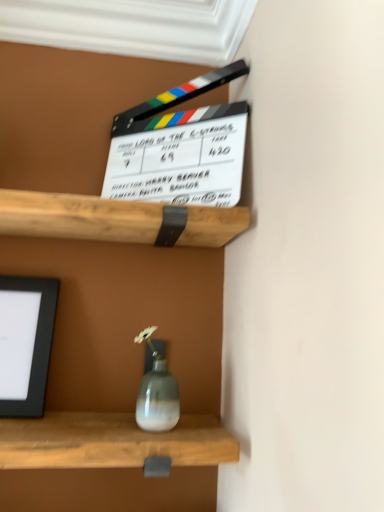
Question: Is point coord(140,48) closer or farther from the camera than point coord(14,289)?

Choices:
 (A) closer
 (B) farther

Answer: (B)

Question: Considering the positions of white smooth window frame at upper center and matte black picture frame at left in the image, is white smooth window frame at upper center taller or shorter than matte black picture frame at left?

Choices:
 (A) tall
 (B) short

Answer: (B)

Question: Is white smooth window frame at upper center in front of or behind matte black picture frame at left in the image?

Choices:
 (A) behind
 (B) front

Answer: (B)

Question: In the image, is matte black picture frame at left on the left side or the right side of white smooth window frame at upper center?

Choices:
 (A) left
 (B) right

Answer: (A)

Question: Considering the positions of matte black picture frame at left and white smooth window frame at upper center in the image, is matte black picture frame at left bigger or smaller than white smooth window frame at upper center?

Choices:
 (A) big
 (B) small

Answer: (B)

Question: Considering the positions of matte black picture frame at left and white smooth window frame at upper center in the image, is matte black picture frame at left wider or thinner than white smooth window frame at upper center?

Choices:
 (A) thin
 (B) wide

Answer: (A)

Question: From a real-world perspective, is matte black picture frame at left above or below white smooth window frame at upper center?

Choices:
 (A) below
 (B) above

Answer: (A)